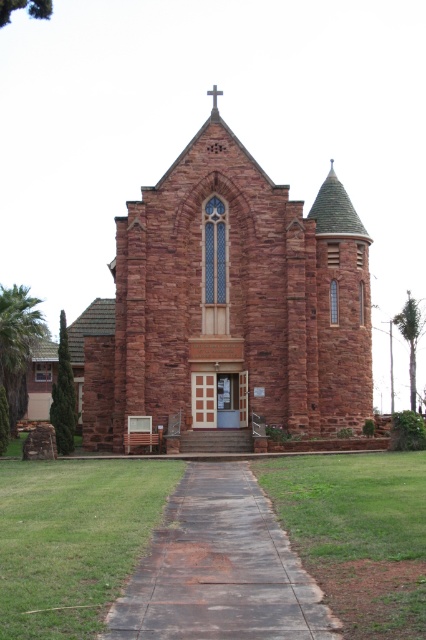
Question: Which point is farther from the camera taking this photo?

Choices:
 (A) (218, 557)
 (B) (126, 428)

Answer: (B)

Question: Which point appears closest to the camera in this image?

Choices:
 (A) (155, 596)
 (B) (239, 150)

Answer: (A)

Question: Does reddish-brown stone church at center have a greater width compared to concrete sidewalk at center?

Choices:
 (A) yes
 (B) no

Answer: (A)

Question: Is reddish-brown stone church at center positioned in front of concrete sidewalk at center?

Choices:
 (A) no
 (B) yes

Answer: (A)

Question: From the image, what is the correct spatial relationship of reddish-brown stone church at center in relation to concrete sidewalk at center?

Choices:
 (A) below
 (B) above

Answer: (B)